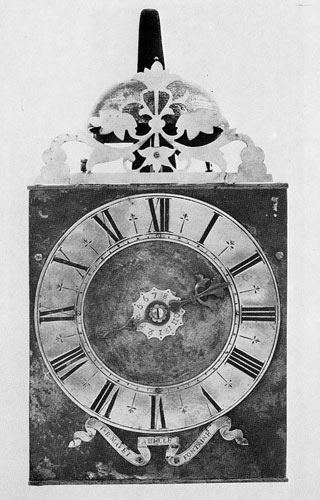
Image resolution: width=320 pixels, height=500 pixels. I want to click on ribbon on bottom of clock, so click(x=116, y=450), click(x=168, y=442), click(x=201, y=443).